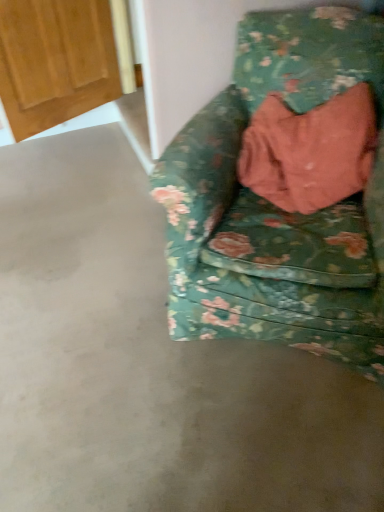
Question: Does wooden door at upper left appear on the left side of floral fabric chair at right?

Choices:
 (A) yes
 (B) no

Answer: (A)

Question: Could floral fabric chair at right be considered to be inside wooden door at upper left?

Choices:
 (A) yes
 (B) no

Answer: (B)

Question: Is wooden door at upper left further to the viewer compared to floral fabric chair at right?

Choices:
 (A) no
 (B) yes

Answer: (B)

Question: Does wooden door at upper left have a greater width compared to floral fabric chair at right?

Choices:
 (A) no
 (B) yes

Answer: (A)

Question: Would you say wooden door at upper left is outside floral fabric chair at right?

Choices:
 (A) yes
 (B) no

Answer: (A)

Question: Is wooden door at upper left smaller than floral fabric chair at right?

Choices:
 (A) no
 (B) yes

Answer: (B)

Question: Is floral fabric chair at right shorter than wooden door at upper left?

Choices:
 (A) no
 (B) yes

Answer: (A)

Question: From the image's perspective, is floral fabric chair at right under wooden door at upper left?

Choices:
 (A) yes
 (B) no

Answer: (A)

Question: Is floral fabric chair at right to the right of wooden door at upper left from the viewer's perspective?

Choices:
 (A) yes
 (B) no

Answer: (A)

Question: Is floral fabric chair at right outside of wooden door at upper left?

Choices:
 (A) yes
 (B) no

Answer: (A)

Question: Is floral fabric chair at right wider than wooden door at upper left?

Choices:
 (A) yes
 (B) no

Answer: (A)

Question: Is floral fabric chair at right aimed at wooden door at upper left?

Choices:
 (A) yes
 (B) no

Answer: (B)

Question: Considering the positions of floral fabric chair at right and wooden door at upper left in the image, is floral fabric chair at right taller or shorter than wooden door at upper left?

Choices:
 (A) short
 (B) tall

Answer: (B)